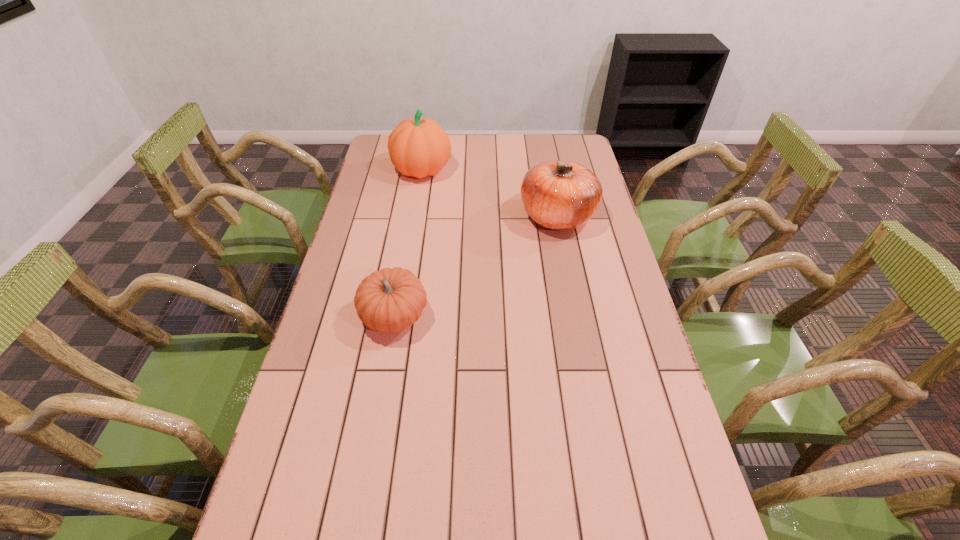
Where is `the tallest pumpkin`? The image size is (960, 540). the tallest pumpkin is located at coordinates (418, 147).

The height and width of the screenshot is (540, 960). Find the location of `the farthest pumpkin`. the farthest pumpkin is located at coordinates (418, 147).

Find the location of `the second tallest object`. the second tallest object is located at coordinates (561, 195).

Where is `the second farthest pumpkin`? Image resolution: width=960 pixels, height=540 pixels. the second farthest pumpkin is located at coordinates (561, 195).

At what (x,y) coordinates should I click in order to perform the action: click on the nearest object. Please return your answer as a coordinate pair (x, y). Looking at the image, I should click on (389, 300).

Identify the location of the shortest pumpkin. The height and width of the screenshot is (540, 960). (389, 300).

The height and width of the screenshot is (540, 960). Find the location of `free space located 0.310m on the front of the tallest object`. free space located 0.310m on the front of the tallest object is located at coordinates 410,241.

The image size is (960, 540). Find the location of `vacant space situated 0.110m on the front of the second farthest pumpkin`. vacant space situated 0.110m on the front of the second farthest pumpkin is located at coordinates (567, 265).

The image size is (960, 540). I want to click on vacant space situated 0.080m on the front of the nearest pumpkin, so click(x=386, y=370).

The image size is (960, 540). Find the location of `object that is at the far edge`. object that is at the far edge is located at coordinates (418, 147).